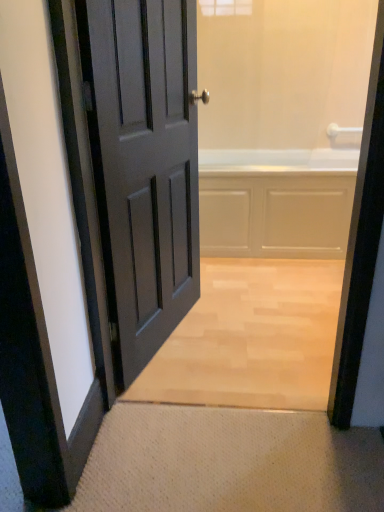
Question: Can you confirm if matte gray door at left is taller than white textured mat at lower center?

Choices:
 (A) yes
 (B) no

Answer: (A)

Question: Considering the relative positions of matte gray door at left and white textured mat at lower center in the image provided, is matte gray door at left to the left of white textured mat at lower center from the viewer's perspective?

Choices:
 (A) no
 (B) yes

Answer: (B)

Question: Can we say matte gray door at left lies outside white textured mat at lower center?

Choices:
 (A) yes
 (B) no

Answer: (A)

Question: Is matte gray door at left far from white textured mat at lower center?

Choices:
 (A) no
 (B) yes

Answer: (A)

Question: Is matte gray door at left positioned with its back to white textured mat at lower center?

Choices:
 (A) no
 (B) yes

Answer: (A)

Question: In the image, is white glossy bathtub at center positioned in front of or behind matte gray door at left?

Choices:
 (A) behind
 (B) front

Answer: (A)

Question: Considering the positions of point (281, 155) and point (190, 182), is point (281, 155) closer or farther from the camera than point (190, 182)?

Choices:
 (A) closer
 (B) farther

Answer: (B)

Question: From the image's perspective, is white glossy bathtub at center positioned above or below matte gray door at left?

Choices:
 (A) above
 (B) below

Answer: (A)

Question: In terms of size, does white glossy bathtub at center appear bigger or smaller than matte gray door at left?

Choices:
 (A) small
 (B) big

Answer: (B)

Question: Would you say white textured mat at lower center is inside or outside matte gray door at left?

Choices:
 (A) inside
 (B) outside

Answer: (B)

Question: From a real-world perspective, is white textured mat at lower center above or below matte gray door at left?

Choices:
 (A) above
 (B) below

Answer: (B)

Question: Considering the positions of point (268, 467) and point (114, 358), is point (268, 467) closer or farther from the camera than point (114, 358)?

Choices:
 (A) farther
 (B) closer

Answer: (B)

Question: Visually, is white textured mat at lower center positioned to the left or to the right of matte gray door at left?

Choices:
 (A) right
 (B) left

Answer: (A)

Question: From a real-world perspective, is white glossy bathtub at center positioned above or below white textured mat at lower center?

Choices:
 (A) below
 (B) above

Answer: (B)

Question: Does point (233, 184) appear closer or farther from the camera than point (324, 475)?

Choices:
 (A) closer
 (B) farther

Answer: (B)